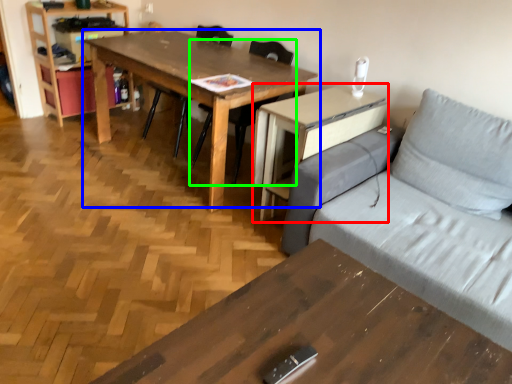
Question: Which object is the closest to the computer desk (highlighted by a red box)? Choose among these: table (highlighted by a blue box) or chair (highlighted by a green box).

Choices:
 (A) table
 (B) chair

Answer: (A)